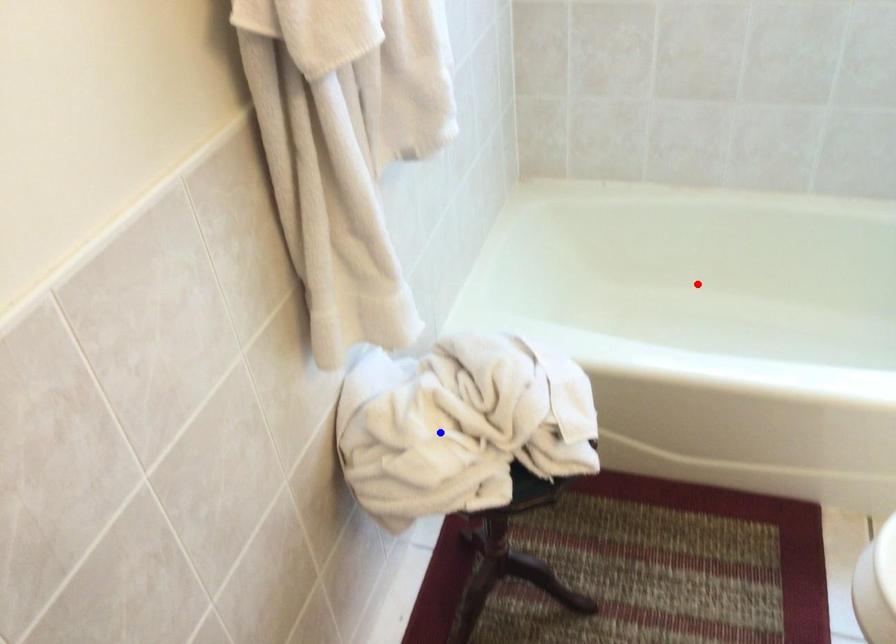
Question: Which of the two points in the image is closer to the camera?

Choices:
 (A) Blue point is closer.
 (B) Red point is closer.

Answer: (A)